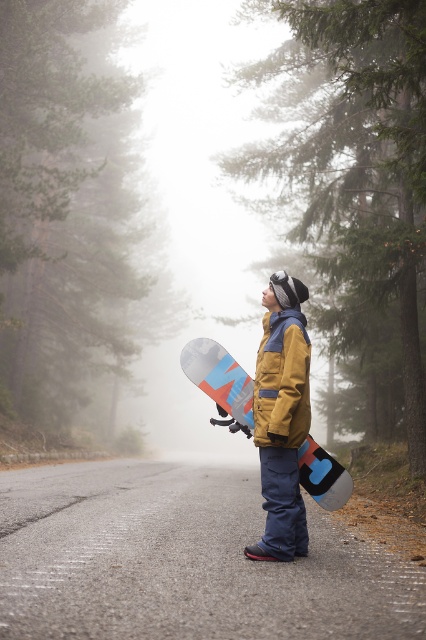
You are a photographer trying to capture the snowboarder and their equipment in the misty forest. Based on the scene, can you determine if the yellow fabric snowboarder at center is positioned above or below the matte blue snowboard at center?

The yellow fabric snowboarder at center is below the matte blue snowboard at center according to the description.

You are planning to take a photo of the yellow fabric snowboarder at center and the matte blue snowboard at center. Which object should you focus on if you want to capture the larger subject in your shot?

The yellow fabric snowboarder at center is bigger than the matte blue snowboard at center, so you should focus on the yellow fabric snowboarder at center to capture the larger subject in your shot.

You are planning to take a photo of the yellow fabric snowboarder at center and the matte blue snowboard at center. Since the camera has a limited focus range, you need to know which object is narrower to ensure proper framing. Which one is narrower?

The yellow fabric snowboarder at center is narrower than the matte blue snowboard at center, so it should be framed accordingly.